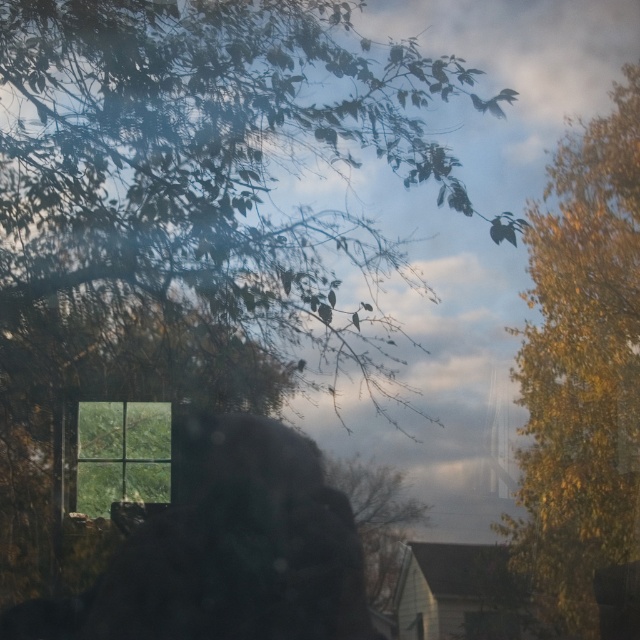
You are standing inside a building looking through a window. You see a silky black hair at center and a green leafy tree at center. Which object is closer to you?

The silky black hair at center is closer to you because it is positioned below the green leafy tree at center, indicating it is in the foreground.

In the scene shown: You are standing in a room looking through a window at a tree branch. There is a point at coordinates point (x=525, y=541). Can you reach that point with your hand if you extend it fully?

The point (x=525, y=541) is 8.89 feet from the viewer, so no, you cannot reach it with your hand as it is too far away.